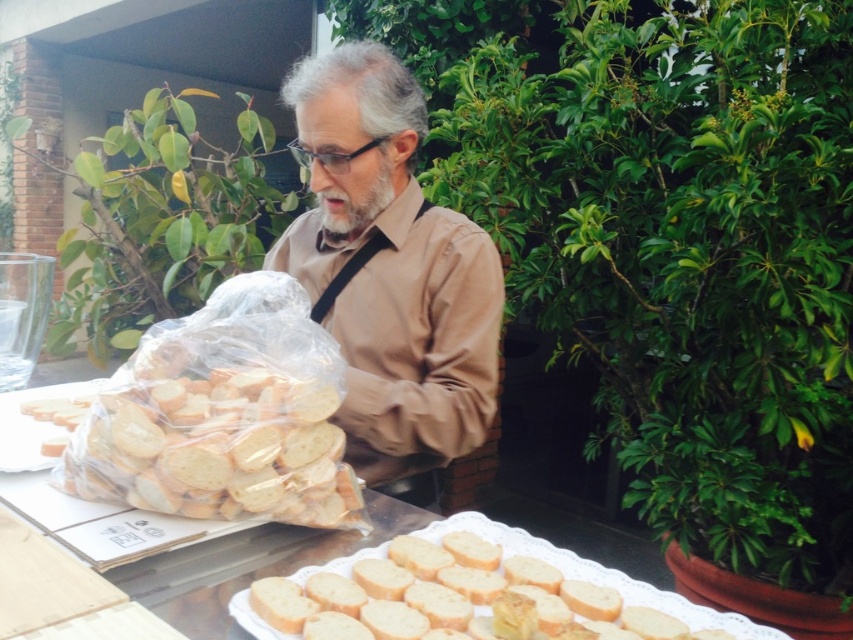
Question: Which of the following is the closest to the observer?

Choices:
 (A) (605, 608)
 (B) (393, 182)

Answer: (A)

Question: Among these points, which one is nearest to the camera?

Choices:
 (A) (392, 476)
 (B) (566, 588)

Answer: (B)

Question: Does matte brown shirt at center have a greater width compared to golden brown crusty bread at lower center?

Choices:
 (A) no
 (B) yes

Answer: (B)

Question: Which point is closer to the camera?

Choices:
 (A) (321, 96)
 (B) (624, 627)

Answer: (B)

Question: Is matte brown shirt at center positioned behind golden brown crusty bread at lower center?

Choices:
 (A) yes
 (B) no

Answer: (A)

Question: Is matte brown shirt at center in front of golden brown crusty bread at lower center?

Choices:
 (A) yes
 (B) no

Answer: (B)